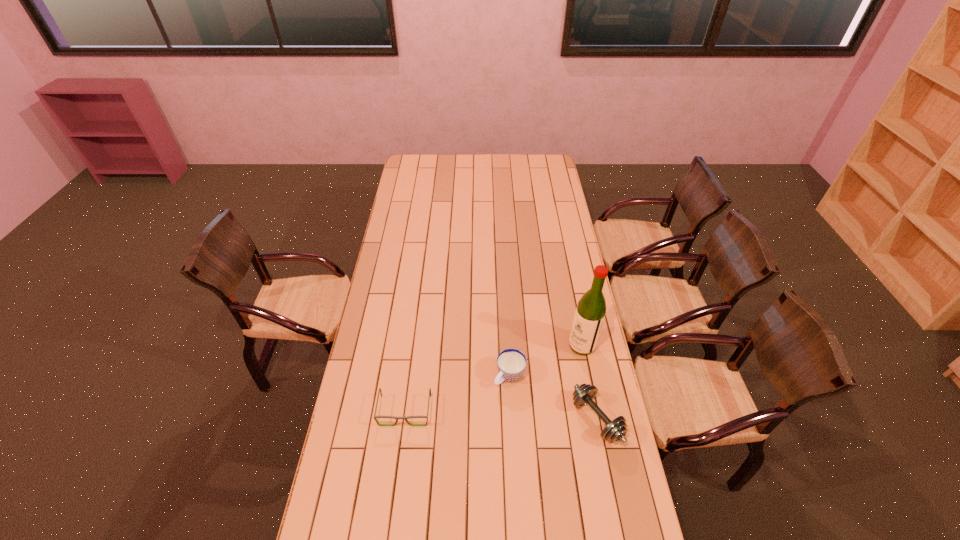
Locate an element on the screen. free space located on the label of the tallest object is located at coordinates (512, 399).

Where is `vacant area situated 0.200m on the label of the tallest object`? vacant area situated 0.200m on the label of the tallest object is located at coordinates click(536, 381).

I want to click on vacant region located on the side of the cup with the handle, so click(x=425, y=461).

Locate an element on the screen. This screenshot has height=540, width=960. vacant space located 0.360m on the side of the cup with the handle is located at coordinates (427, 458).

Locate an element on the screen. vacant space located on the side of the cup with the handle is located at coordinates (491, 395).

Find the location of a particular element. The width and height of the screenshot is (960, 540). object situated at the left edge is located at coordinates (393, 417).

Identify the location of dumbbell situated at the right edge. (584, 394).

Find the location of a particular element. Image resolution: width=960 pixels, height=540 pixels. liquor situated at the right edge is located at coordinates (590, 312).

At what (x,y) coordinates should I click in order to perform the action: click on vacant space at the far edge of the desktop. Please return your answer as a coordinate pair (x, y). The height and width of the screenshot is (540, 960). Looking at the image, I should click on (503, 163).

Where is `free point at the near edge`? free point at the near edge is located at coordinates (420, 512).